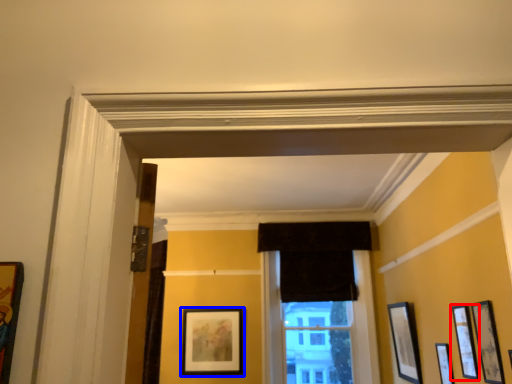
Question: Which object appears farthest to the camera in this image, picture frame (highlighted by a red box) or picture frame (highlighted by a blue box)?

Choices:
 (A) picture frame
 (B) picture frame

Answer: (B)